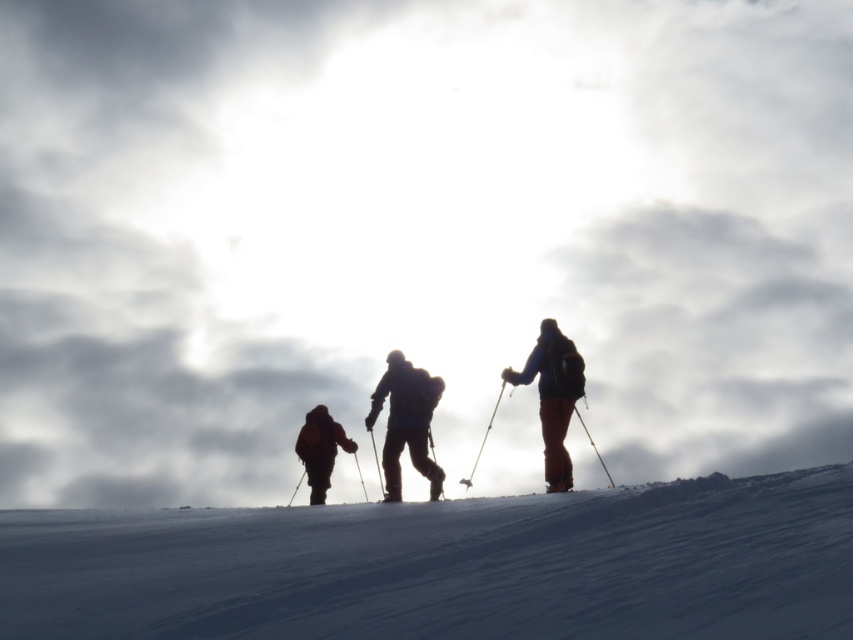
You are planning to take a photo of the dark blue fabric backpack at center and the orange fabric jacket at right. Which object should you focus on first if you want to capture both in the same frame without moving the camera?

The dark blue fabric backpack at center is shorter than the orange fabric jacket at right, so you should focus on the orange fabric jacket at right first to ensure both are in focus since it is taller and might require adjusting the focus range.

You are a hiker planning to carry both the dark blue fabric backpack at center and the dark brown jacket at center. Based on the scene, which item is taller?

The dark blue fabric backpack at center is taller than the dark brown jacket at center.